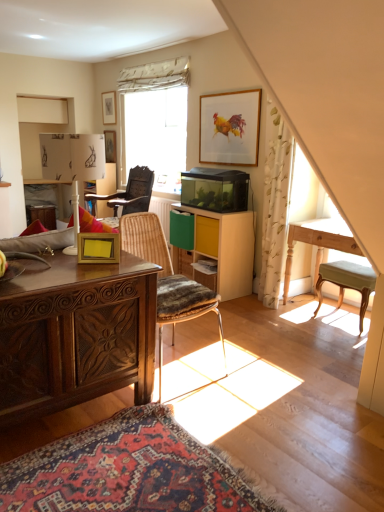
Question: From a real-world perspective, is light wood table at right above or below rustic wood chair at center, the second chair positioned from the right?

Choices:
 (A) below
 (B) above

Answer: (A)

Question: In terms of size, does light wood table at right appear bigger or smaller than rustic wood chair at center, marked as the 1th chair in a front-to-back arrangement?

Choices:
 (A) small
 (B) big

Answer: (B)

Question: Which object is positioned closest to the wooden photo frame at center, the 2th picture frame when ordered from right to left?

Choices:
 (A) matte gold picture frame at upper center, acting as the 2th picture frame starting from the left
 (B) light wood table at right
 (C) rustic wood chair at center, marked as the 1th chair in a front-to-back arrangement
 (D) yellow matte drawer at center
 (E) wooden picture frame at upper center, which appears as the 3th picture frame when viewed from the back

Answer: (C)

Question: Which of these objects is positioned farthest from the rustic wood chair at center, the 2th chair viewed from the left?

Choices:
 (A) matte gold picture frame at upper center, the 1th picture frame in the top-to-bottom sequence
 (B) wooden armchair at center, the first chair viewed from the left
 (C) polished wood desk at left
 (D) yellow matte cabinet at center
 (E) wooden picture frame at upper center, which appears as the 3th picture frame when viewed from the back

Answer: (A)